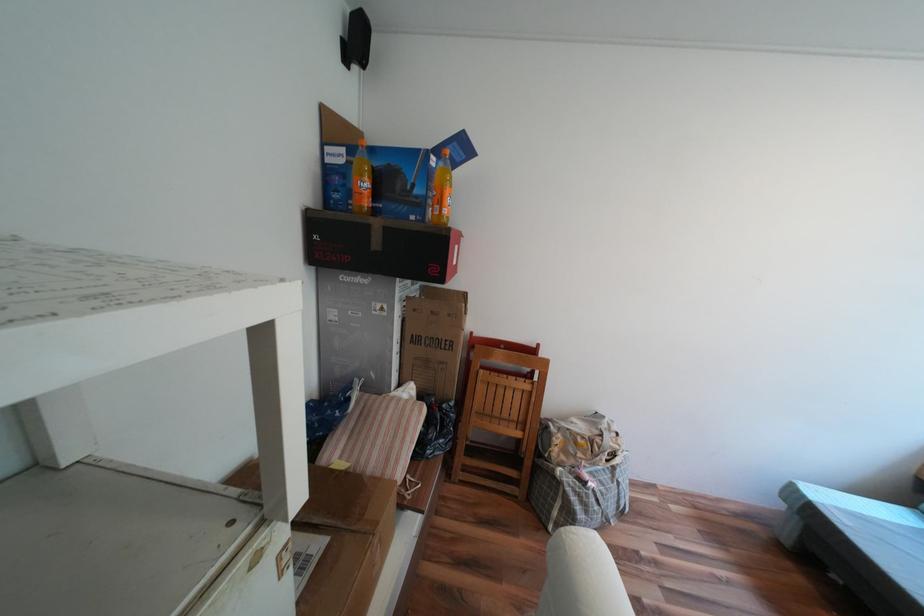
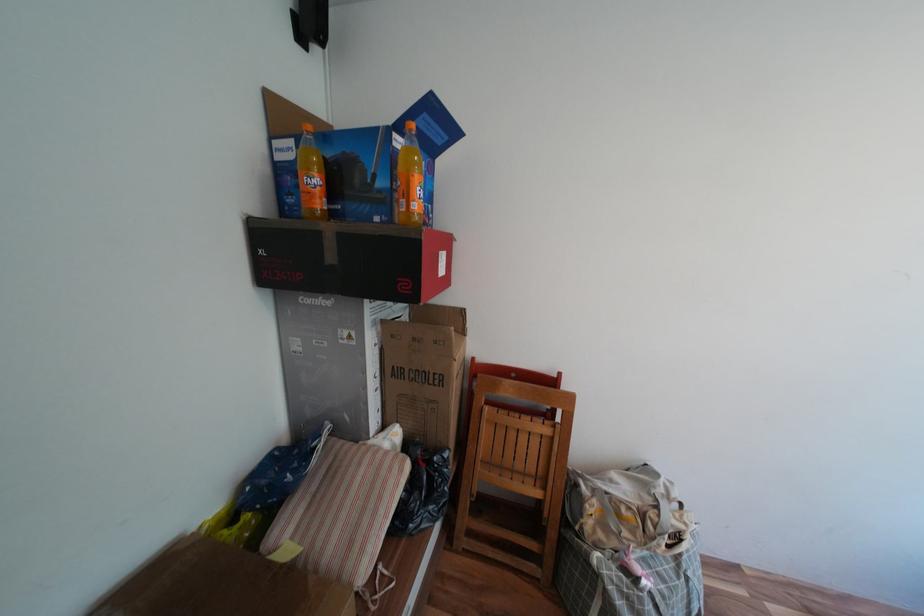
Which direction would the cameraman need to move to produce the second image?

The movement direction of the cameraman is right, forward.